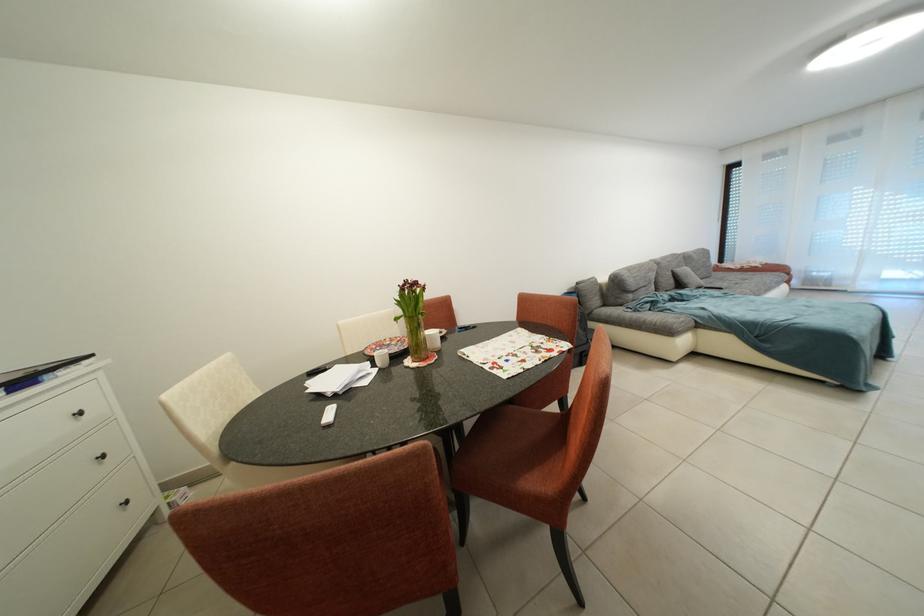
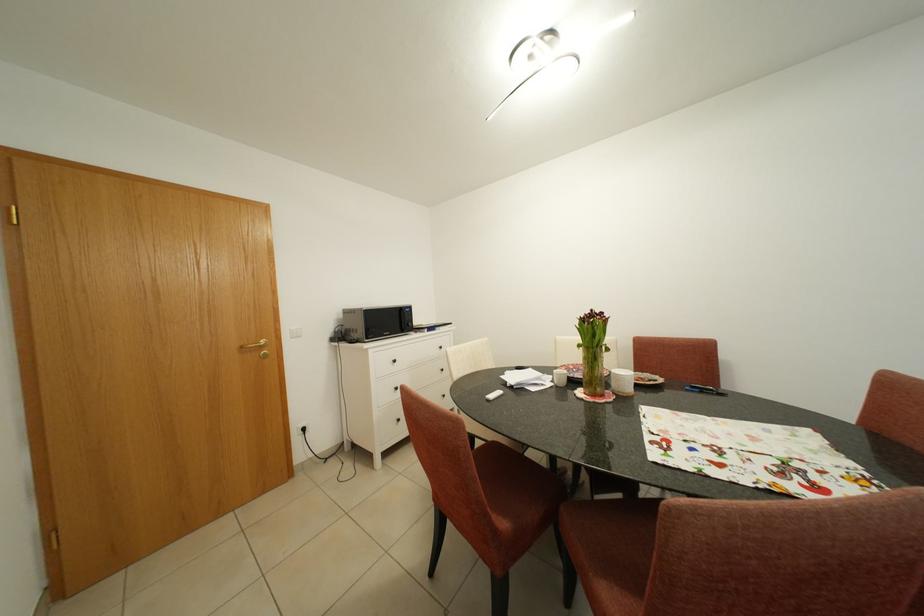
Question: The camera is either moving clockwise (left) or counter-clockwise (right) around the object. The first image is from the beginning of the video and the second image is from the end. Is the camera moving left or right when shooting the video?

Choices:
 (A) Left
 (B) Right

Answer: (B)